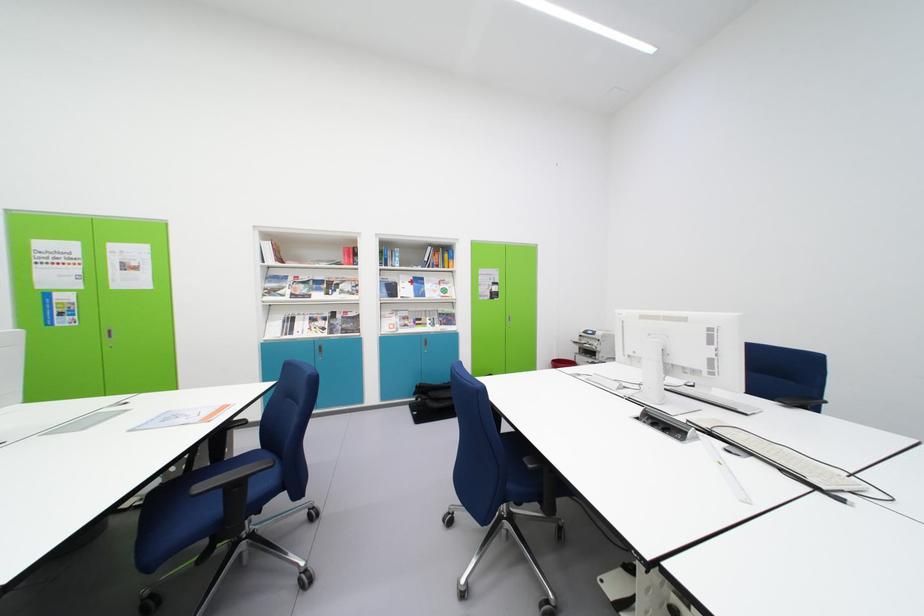
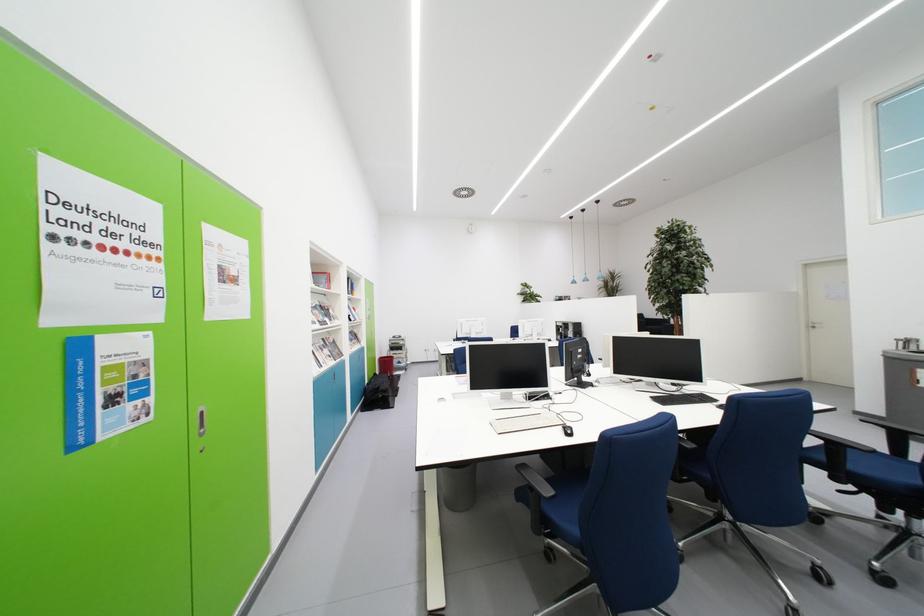
Question: I am providing you with two images of the same scene from different viewpoints. After the viewpoint changes to image2, which objects are now occluded?

Choices:
 (A) bottle pump dispenser
 (B) blue chair sitting surface
 (C) paper document
 (D) black chair armrest

Answer: (C)